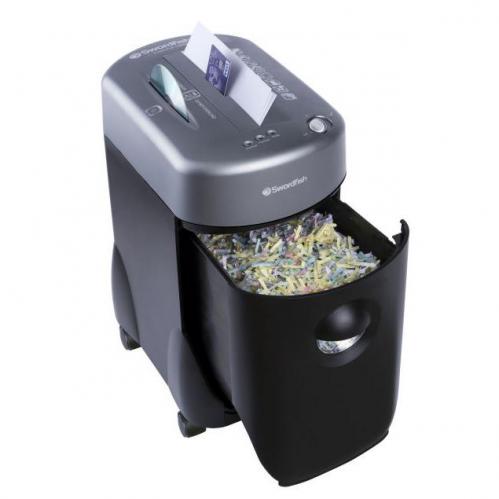
Where is `cd disk`? This screenshot has height=499, width=499. cd disk is located at coordinates (167, 90).